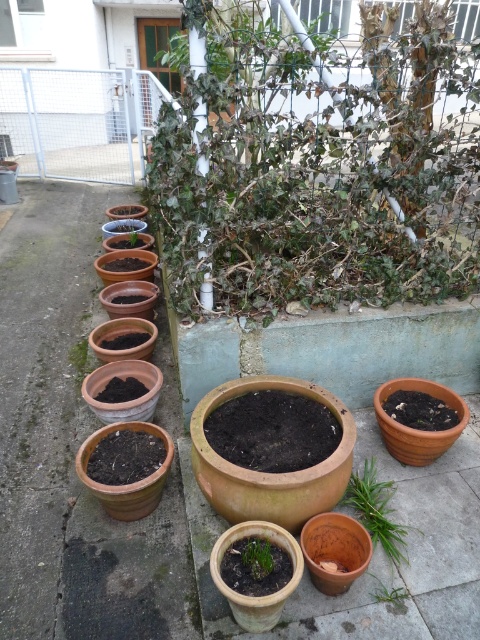
Between terracotta clay pots at center and green leafy plant at lower right, which one appears on the left side from the viewer's perspective?

terracotta clay pots at center is more to the left.

Does terracotta clay pots at center come behind green leafy plant at lower right?

No, it is in front of green leafy plant at lower right.

In the scene shown: Who is more distant from viewer, (x=408, y=616) or (x=376, y=538)?

Positioned behind is point (x=376, y=538).

Identify the location of terracotta clay pots at center. (71, 448).

How much distance is there between terracotta clay pots at center and green matte plant at center?

terracotta clay pots at center is 1.22 meters away from green matte plant at center.

Between terracotta clay pots at center and green matte plant at center, which one is positioned lower?

Positioned lower is green matte plant at center.

Is point (187, 576) behind point (256, 556)?

Yes, it is.

Find the location of a particular element. terracotta clay pots at center is located at coordinates (71, 448).

Can you confirm if green leafy plant at lower right is positioned above green matte plant at center?

Correct, green leafy plant at lower right is located above green matte plant at center.

Who is positioned more to the right, green leafy plant at lower right or green matte plant at center?

Positioned to the right is green leafy plant at lower right.

What do you see at coordinates (375, 509) in the screenshot?
I see `green leafy plant at lower right` at bounding box center [375, 509].

The height and width of the screenshot is (640, 480). I want to click on green leafy plant at lower right, so click(375, 509).